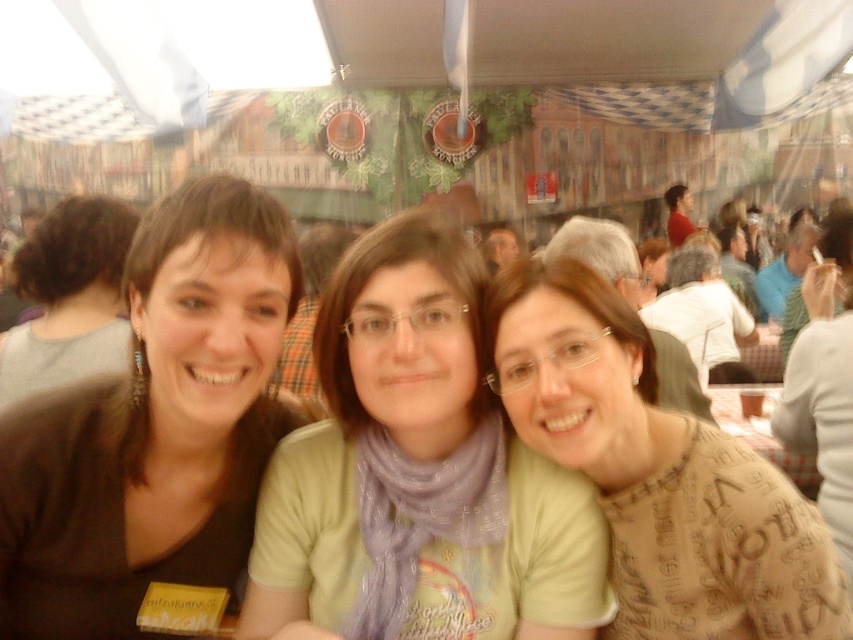
You are a photographer at the event and want to ensure both the brown printed sweater at center and the brown hair at left are clearly visible in the photo. Which object should you focus on to ensure it doesn not get cut off if the frame is tight?

The brown printed sweater at center should be prioritized as it has a lesser width compared to the brown hair at left, making it more likely to fit within a tight frame without being cut off.